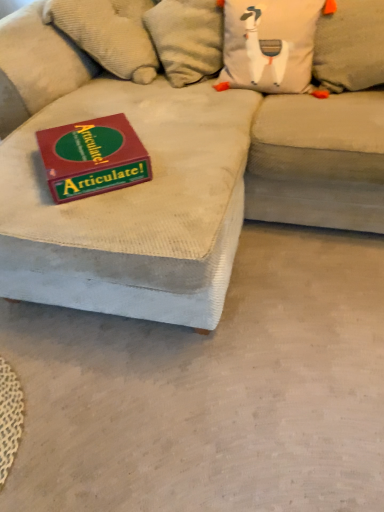
Where is `vacant area on top of matte red box at upper left (from a real-world perspective)`? vacant area on top of matte red box at upper left (from a real-world perspective) is located at coordinates (86, 142).